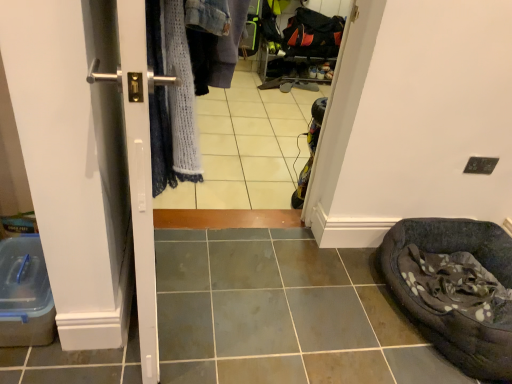
Question: Does satin silver handle at left turn towards dark gray fabric bean bag at lower right?

Choices:
 (A) yes
 (B) no

Answer: (A)

Question: Is satin silver handle at left thinner than dark gray fabric bean bag at lower right?

Choices:
 (A) yes
 (B) no

Answer: (A)

Question: Is satin silver handle at left smaller than dark gray fabric bean bag at lower right?

Choices:
 (A) yes
 (B) no

Answer: (B)

Question: From the image's perspective, is satin silver handle at left above dark gray fabric bean bag at lower right?

Choices:
 (A) yes
 (B) no

Answer: (A)

Question: Would you say dark gray fabric bean bag at lower right is part of satin silver handle at left's contents?

Choices:
 (A) no
 (B) yes

Answer: (A)

Question: Considering their positions, is satin silver handle at left located in front of or behind dark gray fabric bean bag at lower right?

Choices:
 (A) front
 (B) behind

Answer: (A)

Question: Which is correct: satin silver handle at left is inside dark gray fabric bean bag at lower right, or outside of it?

Choices:
 (A) outside
 (B) inside

Answer: (A)

Question: Is satin silver handle at left taller or shorter than dark gray fabric bean bag at lower right?

Choices:
 (A) tall
 (B) short

Answer: (A)

Question: Would you say satin silver handle at left is to the left or to the right of dark gray fabric bean bag at lower right in the picture?

Choices:
 (A) left
 (B) right

Answer: (A)

Question: Considering the positions of dark gray fabric bean bag at lower right and satin silver handle at left in the image, is dark gray fabric bean bag at lower right taller or shorter than satin silver handle at left?

Choices:
 (A) tall
 (B) short

Answer: (B)

Question: Considering the positions of dark gray fabric bean bag at lower right and satin silver handle at left in the image, is dark gray fabric bean bag at lower right bigger or smaller than satin silver handle at left?

Choices:
 (A) small
 (B) big

Answer: (A)

Question: Does point (416, 228) appear closer or farther from the camera than point (131, 104)?

Choices:
 (A) farther
 (B) closer

Answer: (A)

Question: From the image's perspective, is dark gray fabric bean bag at lower right located above or below satin silver handle at left?

Choices:
 (A) below
 (B) above

Answer: (A)

Question: In the image, is satin silver handle at left positioned in front of or behind white glossy tile at center?

Choices:
 (A) front
 (B) behind

Answer: (A)

Question: Is point (145, 243) closer or farther from the camera than point (211, 193)?

Choices:
 (A) farther
 (B) closer

Answer: (B)